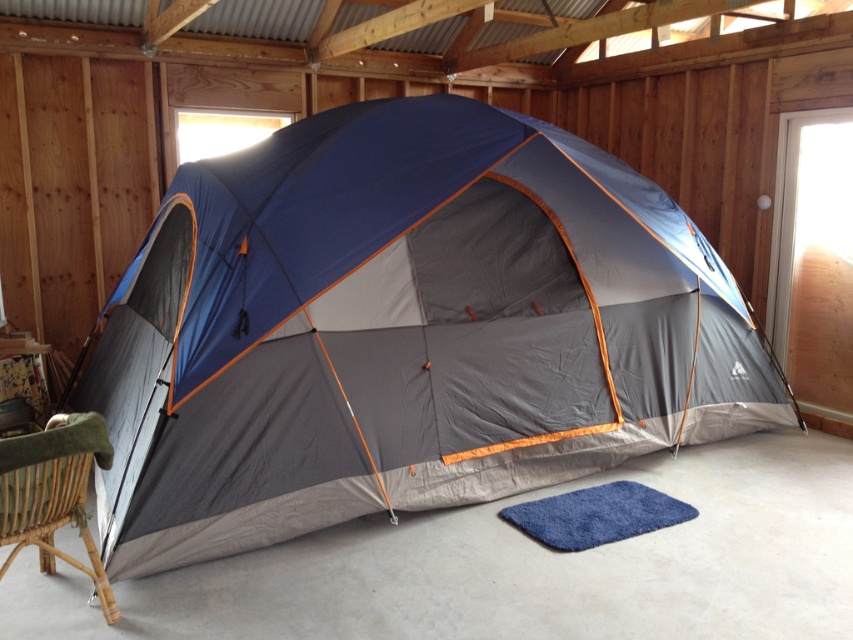
Between point (529, 445) and point (62, 442), which one is positioned in front?

Point (62, 442) is in front.

Locate an element on the screen. blue fabric tent at center is located at coordinates click(404, 330).